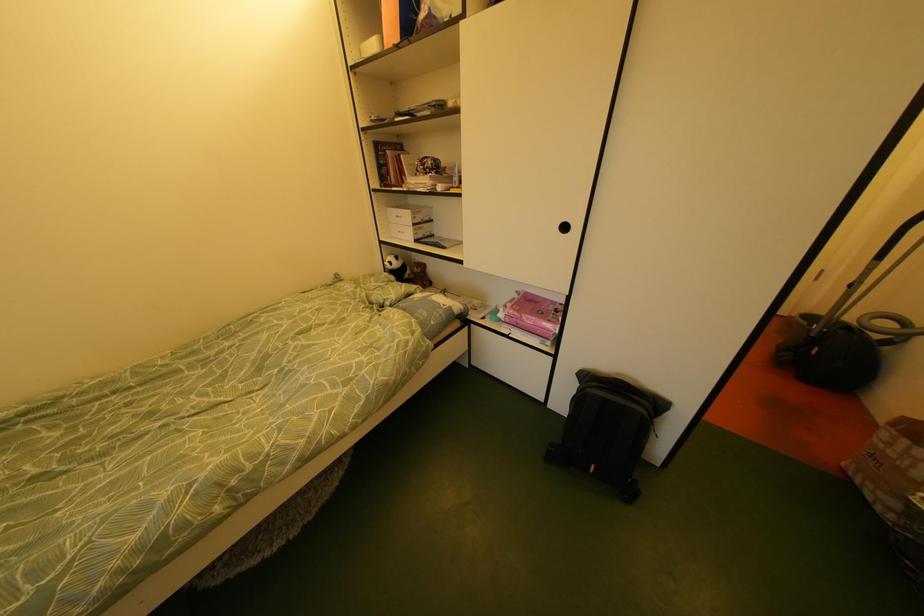
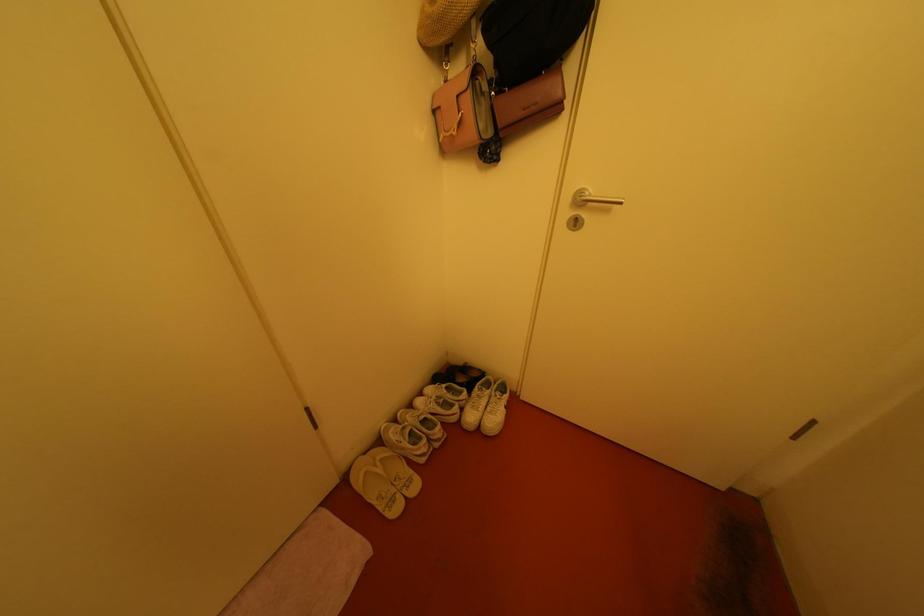
Which direction would the cameraman need to move to produce the second image?

The cameraman moved toward right, forward.